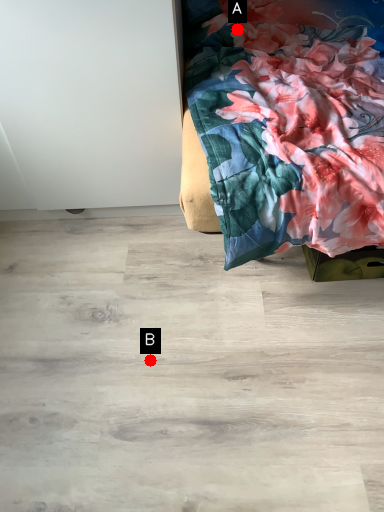
Question: Two points are circled on the image, labeled by A and B beside each circle. Which point is closer to the camera?

Choices:
 (A) A is closer
 (B) B is closer

Answer: (B)